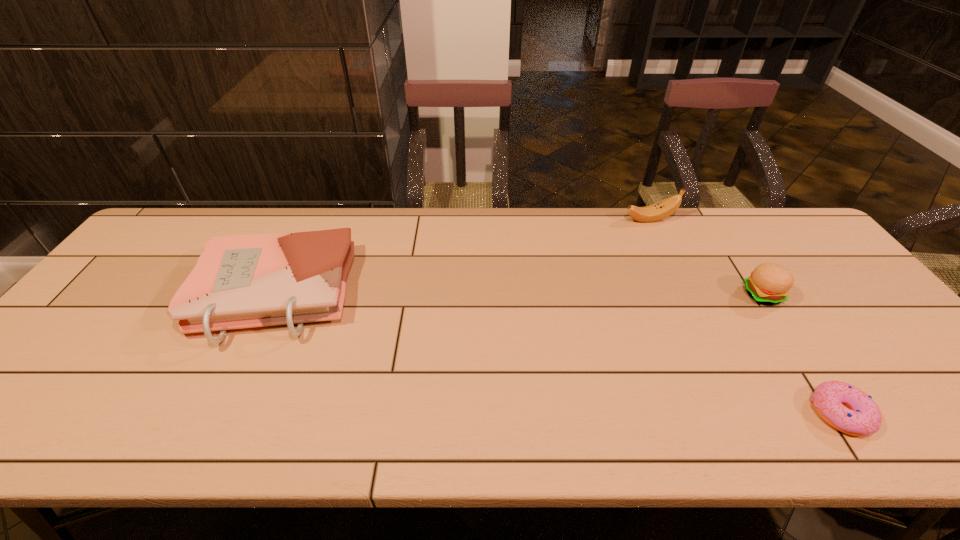
You are a GUI agent. You are given a task and a screenshot of the screen. Output one action in this format:
    pyautogui.click(x=<x>, y=<y>)
    Task: Click on the banana
    
    Given the screenshot: What is the action you would take?
    pyautogui.click(x=664, y=208)

Locate an element on the screen. The image size is (960, 540). the farthest object is located at coordinates (664, 208).

The height and width of the screenshot is (540, 960). In order to click on phonebook in this screenshot , I will do `click(240, 281)`.

The width and height of the screenshot is (960, 540). I want to click on hamburger, so click(x=769, y=283).

Image resolution: width=960 pixels, height=540 pixels. In order to click on doughnut in this screenshot , I will do `click(844, 407)`.

Where is `the shortest object`? Image resolution: width=960 pixels, height=540 pixels. the shortest object is located at coordinates (844, 407).

Find the location of a particular element. vacant space located 0.130m on the front of the farthest object is located at coordinates (665, 250).

Find the location of a particular element. The width and height of the screenshot is (960, 540). vacant space located on the right of the leftmost object is located at coordinates (444, 294).

You are a GUI agent. You are given a task and a screenshot of the screen. Output one action in this format:
    pyautogui.click(x=<x>, y=<y>)
    Task: Click on the free spot located 0.250m on the left of the hamburger
    
    Given the screenshot: What is the action you would take?
    pyautogui.click(x=652, y=295)

I want to click on vacant region located 0.180m on the right of the doughnut, so click(953, 414).